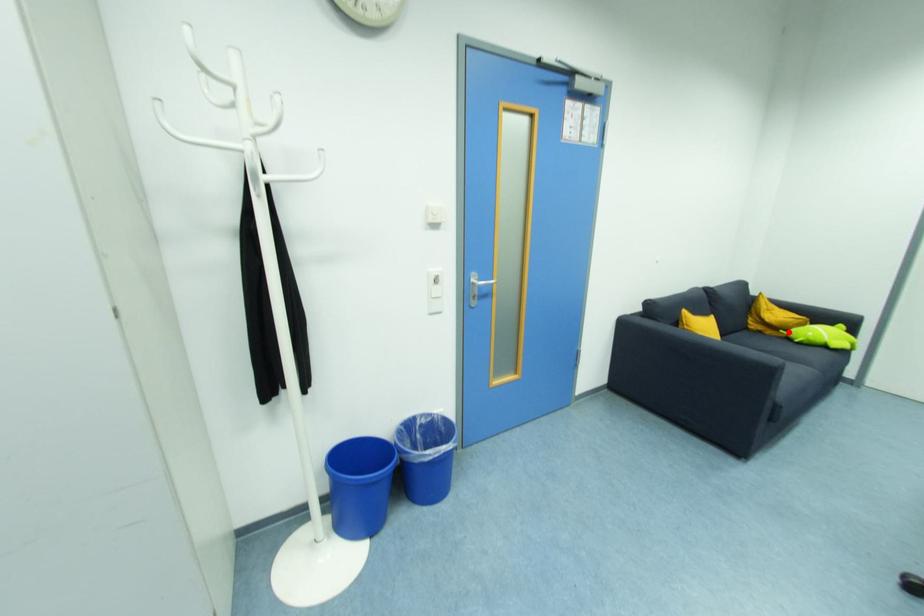
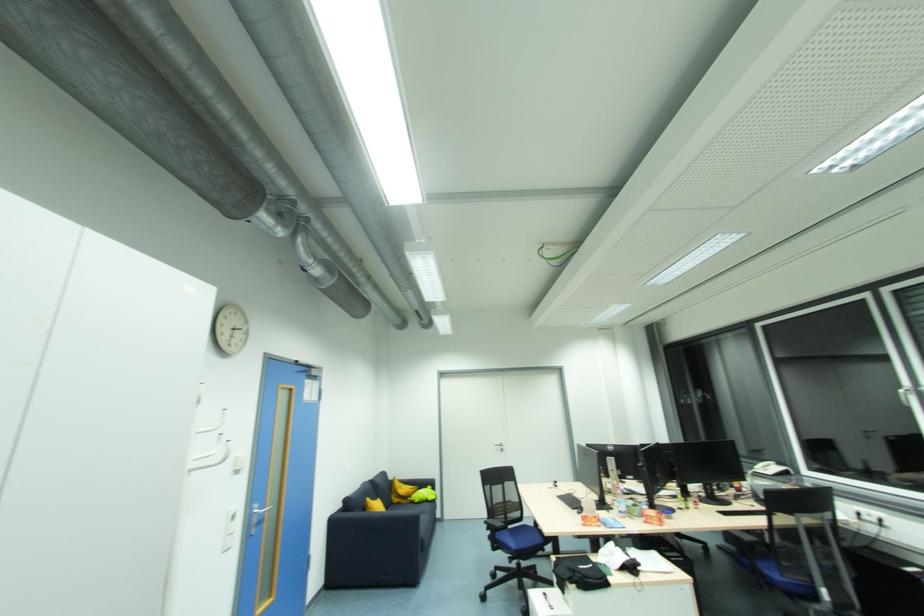
Question: I am providing you with two images of the same scene from different viewpoints. In image1, a red point is highlighted. Considering the same 3D point in image2, which of the following is correct?

Choices:
 (A) It is closer
 (B) It is farther

Answer: (B)